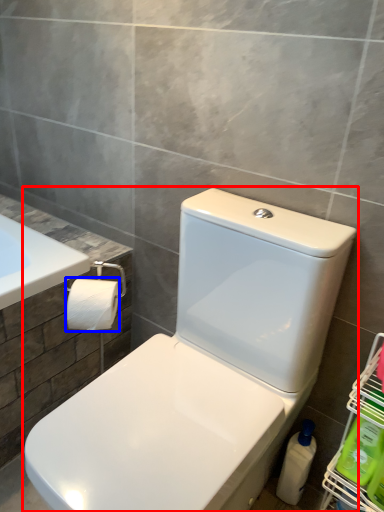
Question: Which point is closer to the camera, toilet (highlighted by a red box) or toilet paper (highlighted by a blue box)?

Choices:
 (A) toilet
 (B) toilet paper

Answer: (A)